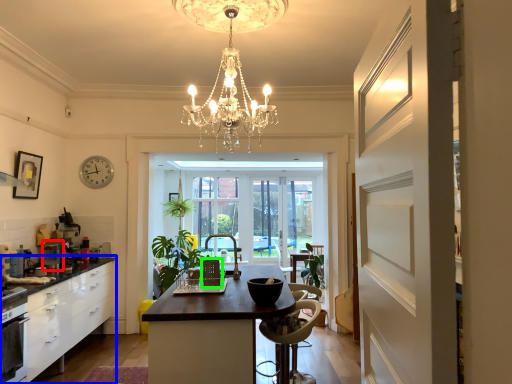
Question: Estimate the real-world distances between objects in this image. Which object is closer to appliance (highlighted by a red box), cabinetry (highlighted by a blue box) or chair (highlighted by a green box)?

Choices:
 (A) cabinetry
 (B) chair

Answer: (A)